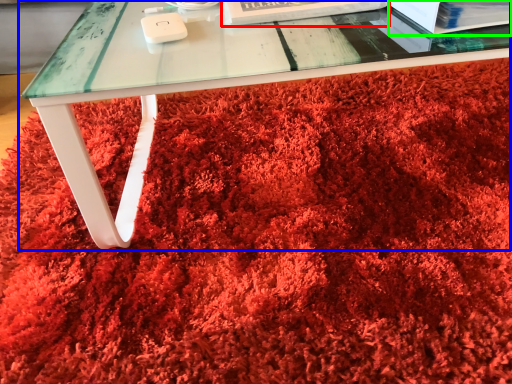
Question: Considering the real-world distances, which object is closest to paperback book (highlighted by a red box)? table (highlighted by a blue box) or paperback book (highlighted by a green box).

Choices:
 (A) table
 (B) paperback book

Answer: (B)